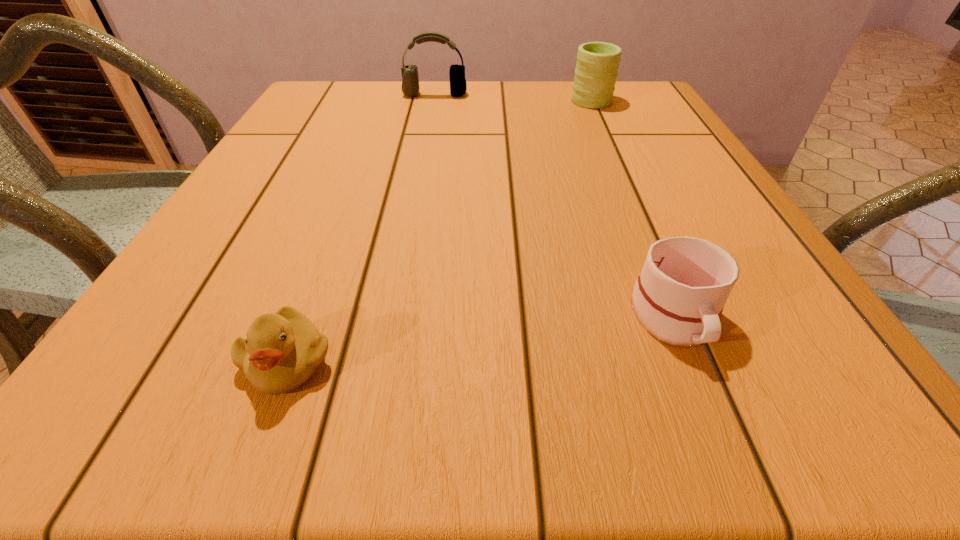
Where is `headset`? headset is located at coordinates (410, 82).

The height and width of the screenshot is (540, 960). Identify the location of the taller mug. (597, 65).

Locate an element on the screen. the farther mug is located at coordinates (597, 65).

In order to click on the nearer mug in this screenshot , I will do `click(679, 296)`.

Where is `duckling`? Image resolution: width=960 pixels, height=540 pixels. duckling is located at coordinates (281, 351).

Image resolution: width=960 pixels, height=540 pixels. Find the location of `vacant space situated 0.280m on the headband of the tallest object`. vacant space situated 0.280m on the headband of the tallest object is located at coordinates (424, 152).

What are the coordinates of `vacant space located on the side with the handle of the nearer mug` in the screenshot? It's located at (708, 398).

Identify the location of headset located in the far edge section of the desktop. (410, 82).

Locate an element on the screen. The image size is (960, 540). mug that is at the far edge is located at coordinates (597, 65).

Identify the location of mug that is at the near edge. (679, 296).